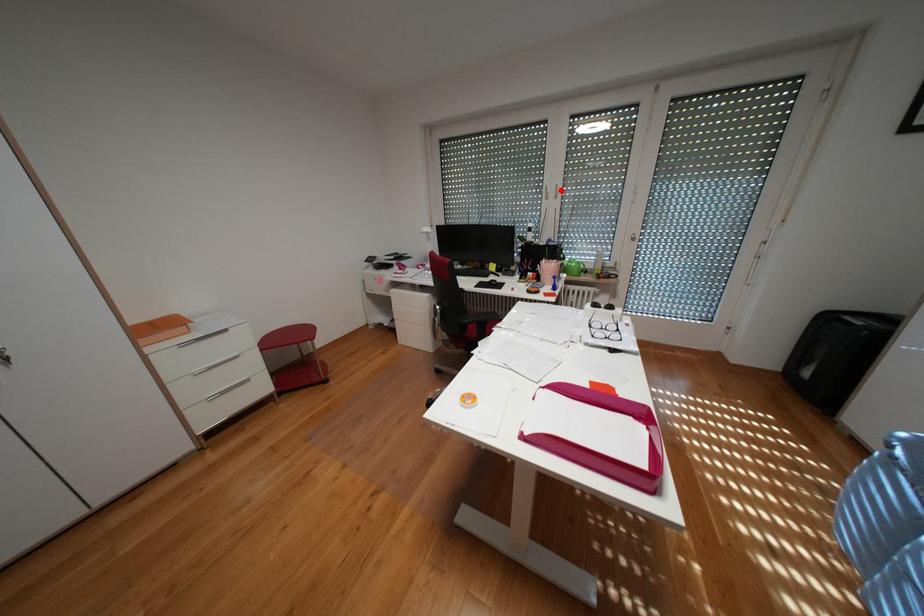
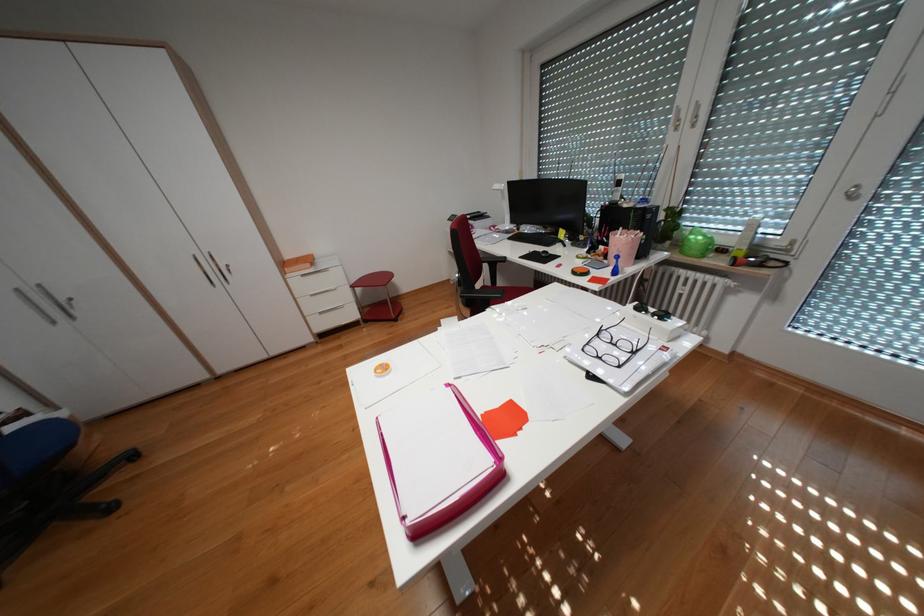
Question: I am providing you with two images of the same scene from different viewpoints. Given a red point in image1, look at the same physical point in image2. Is it:

Choices:
 (A) Closer to the viewpoint
 (B) Farther from the viewpoint

Answer: (B)